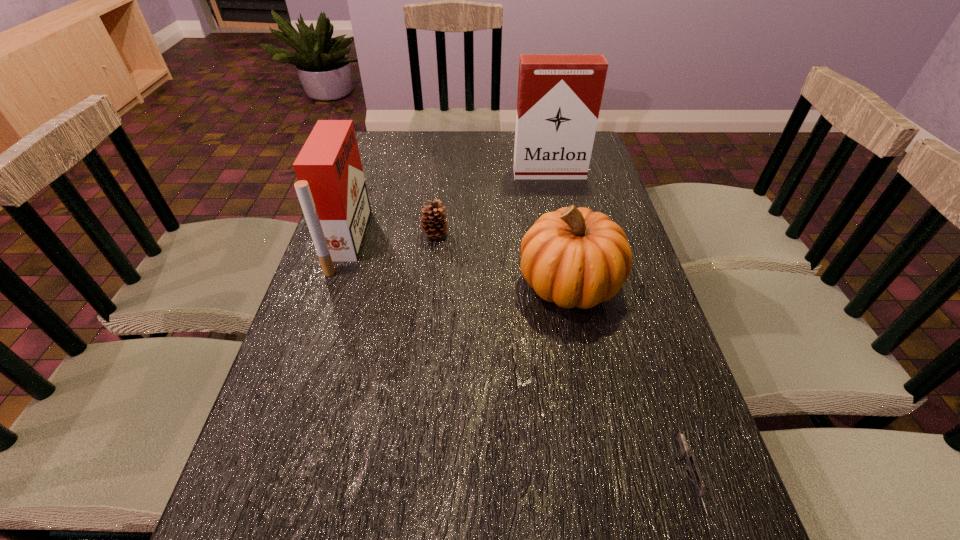
At what (x,y) coordinates should I click in order to perform the action: click on vacant space located 0.370m on the front-facing side of the fourth shortest object. Please return your answer as a coordinate pair (x, y). The height and width of the screenshot is (540, 960). Looking at the image, I should click on (499, 241).

I want to click on free region located 0.100m on the back of the third tallest object, so click(558, 226).

Find the location of `blank space located 0.320m on the front of the second object from left to right`. blank space located 0.320m on the front of the second object from left to right is located at coordinates [x=423, y=338].

I want to click on object that is at the left edge, so click(331, 188).

What are the coordinates of `cigarette_case that is at the right edge` in the screenshot? It's located at (559, 96).

The height and width of the screenshot is (540, 960). I want to click on pumpkin that is at the right edge, so click(575, 257).

Locate an element on the screen. The width and height of the screenshot is (960, 540). gun at the right edge is located at coordinates (692, 466).

In the image, there is a desktop. At what (x,y) coordinates should I click in order to perform the action: click on vacant space at the far edge. Please return your answer as a coordinate pair (x, y). Looking at the image, I should click on (436, 134).

Image resolution: width=960 pixels, height=540 pixels. In the image, there is a desktop. Identify the location of free space at the left edge. (385, 201).

Locate an element on the screen. The width and height of the screenshot is (960, 540). vacant space at the right edge of the desktop is located at coordinates (599, 187).